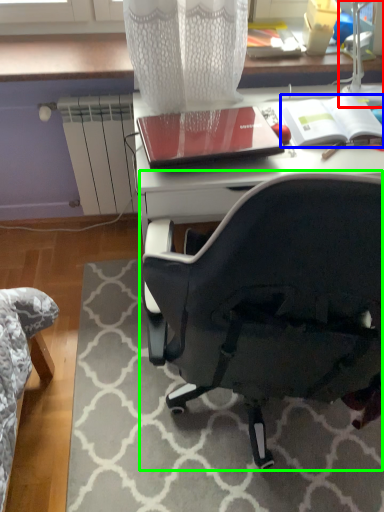
Question: Considering the real-world distances, which object is closest to table lamp (highlighted by a red box)? notebook (highlighted by a blue box) or chair (highlighted by a green box).

Choices:
 (A) notebook
 (B) chair

Answer: (A)